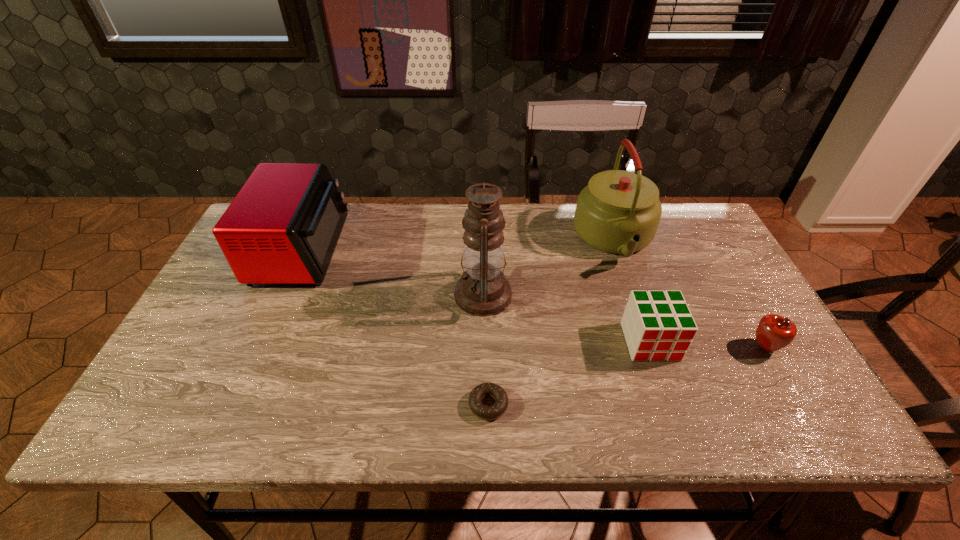
This screenshot has height=540, width=960. What are the coordinates of `free spot between the third shortest object and the tallest object` in the screenshot? It's located at (566, 318).

Locate an element on the screen. Image resolution: width=960 pixels, height=540 pixels. vacant space in between the oil lamp and the nearest object is located at coordinates (486, 350).

Identify the location of free space between the toaster oven and the apple. (534, 299).

Locate an element on the screen. unoccupied area between the tallest object and the shortest object is located at coordinates pos(486,350).

This screenshot has width=960, height=540. Identify the location of free space between the fourth tallest object and the apple. point(708,345).

Identify which object is the fourth closest to the toaster oven. Please provide its 2D coordinates. Your answer should be formatted as a tuple, i.e. [(x, y)], where the tuple contains the x and y coordinates of a point satisfying the conditions above.

[(657, 325)]

Locate which object ranks second in proximity to the shortest object. Please provide its 2D coordinates. Your answer should be formatted as a tuple, i.e. [(x, y)], where the tuple contains the x and y coordinates of a point satisfying the conditions above.

[(657, 325)]

Where is `vacant space that satisfies the following two spatial constraints: 1. on the red face of the apple; 2. on the right side of the cube`? The image size is (960, 540). vacant space that satisfies the following two spatial constraints: 1. on the red face of the apple; 2. on the right side of the cube is located at coordinates (652, 347).

I want to click on vacant area that satisfies the following two spatial constraints: 1. on the front-facing side of the doughnut; 2. on the right side of the toaster oven, so click(234, 405).

Identify the location of free space in the image that satisfies the following two spatial constraints: 1. on the red face of the apple; 2. on the right side of the third shortest object. The width and height of the screenshot is (960, 540). (652, 347).